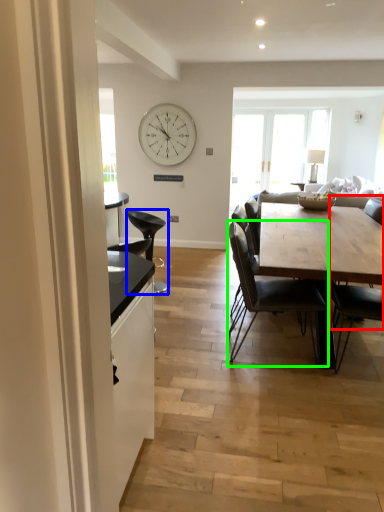
Question: Which object is the closest to the chair (highlighted by a red box)? Choose among these: chair (highlighted by a blue box) or chair (highlighted by a green box).

Choices:
 (A) chair
 (B) chair

Answer: (B)